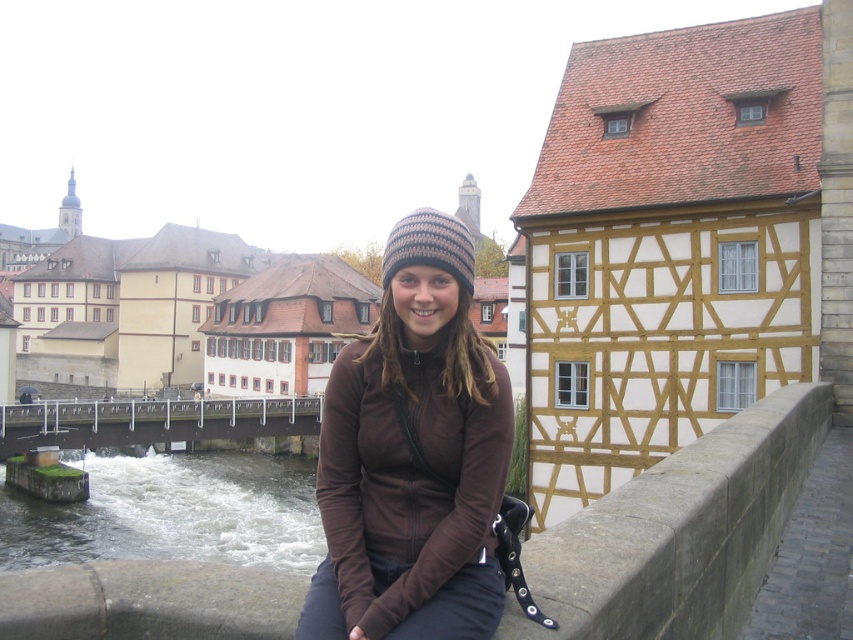
Is white frothy water at lower left further to the viewer compared to metallic gray bridge at lower left?

No, white frothy water at lower left is closer to the viewer.

Who is taller, white frothy water at lower left or metallic gray bridge at lower left?

metallic gray bridge at lower left

Find the location of a particular element. Image resolution: width=853 pixels, height=640 pixels. white frothy water at lower left is located at coordinates (171, 513).

Find the location of a particular element. The image size is (853, 640). white frothy water at lower left is located at coordinates (171, 513).

Which is above, gray concrete ledge at lower center or matte brown building at upper left?

matte brown building at upper left is above.

Can you confirm if gray concrete ledge at lower center is positioned above matte brown building at upper left?

Actually, gray concrete ledge at lower center is below matte brown building at upper left.

Describe the element at coordinates (679, 532) in the screenshot. I see `gray concrete ledge at lower center` at that location.

In order to click on gray concrete ledge at lower center in this screenshot , I will do `click(679, 532)`.

Who is shorter, metallic gray bridge at lower left or brown knitted beanie at center?

metallic gray bridge at lower left

What do you see at coordinates (152, 420) in the screenshot? I see `metallic gray bridge at lower left` at bounding box center [152, 420].

Identify the location of metallic gray bridge at lower left. The height and width of the screenshot is (640, 853). (152, 420).